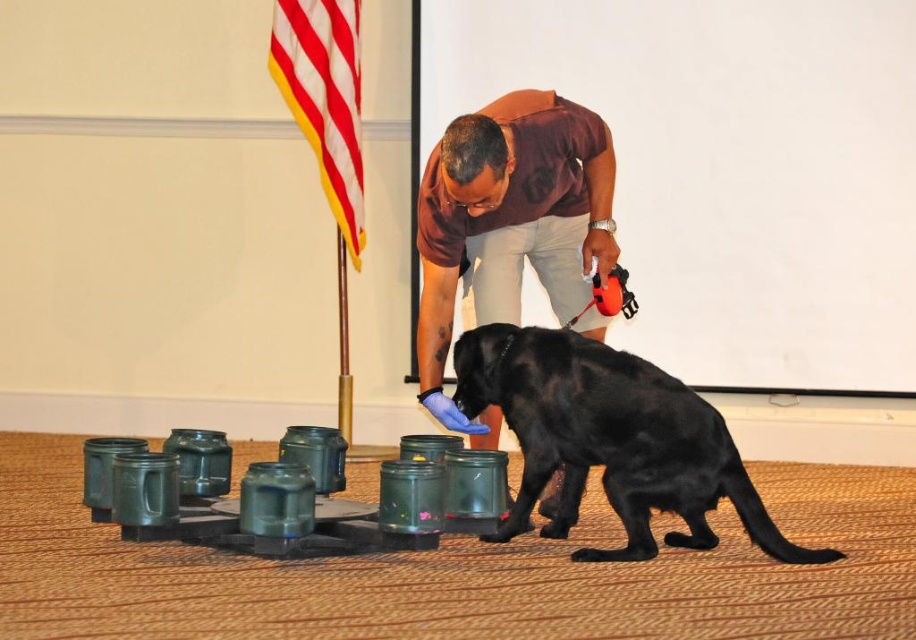
Question: Which point is farther to the camera?

Choices:
 (A) black matte dog at center
 (B) red and white striped flag at upper left
 (C) matte brown shirt at center

Answer: (B)

Question: Among these objects, which one is nearest to the camera?

Choices:
 (A) matte brown shirt at center
 (B) black matte dog at center

Answer: (A)

Question: Does matte brown shirt at center lie behind red and white striped flag at upper left?

Choices:
 (A) no
 (B) yes

Answer: (A)

Question: Among these objects, which one is farthest from the camera?

Choices:
 (A) black matte dog at center
 (B) matte brown shirt at center
 (C) red and white striped flag at upper left

Answer: (C)

Question: Can you confirm if matte brown shirt at center is positioned below red and white striped flag at upper left?

Choices:
 (A) yes
 (B) no

Answer: (A)

Question: Is black matte dog at center wider than red and white striped flag at upper left?

Choices:
 (A) yes
 (B) no

Answer: (A)